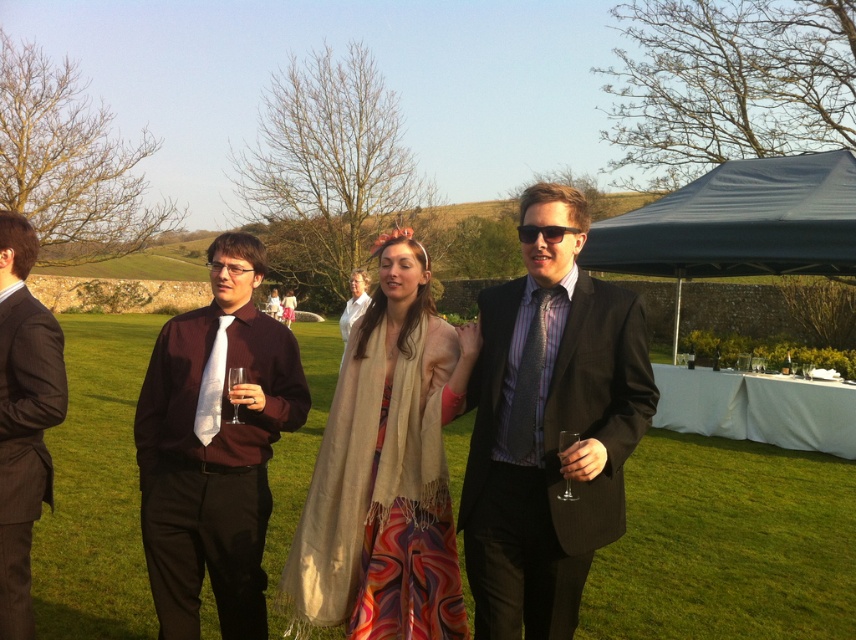
You are standing on the grassy lawn and looking at the scene. Which object is closer to the ground, the green grass at center or the matte burgundy shirt at center?

The green grass at center is closer to the ground because it is located below the matte burgundy shirt at center.

You are standing at the position of point (512, 420) and want to move towards point (528, 365). Is the path between these two points clear of any obstacles?

Yes, the path between point (528, 365) and point (512, 420) is clear since there are no objects mentioned in the scene description that would block the way.